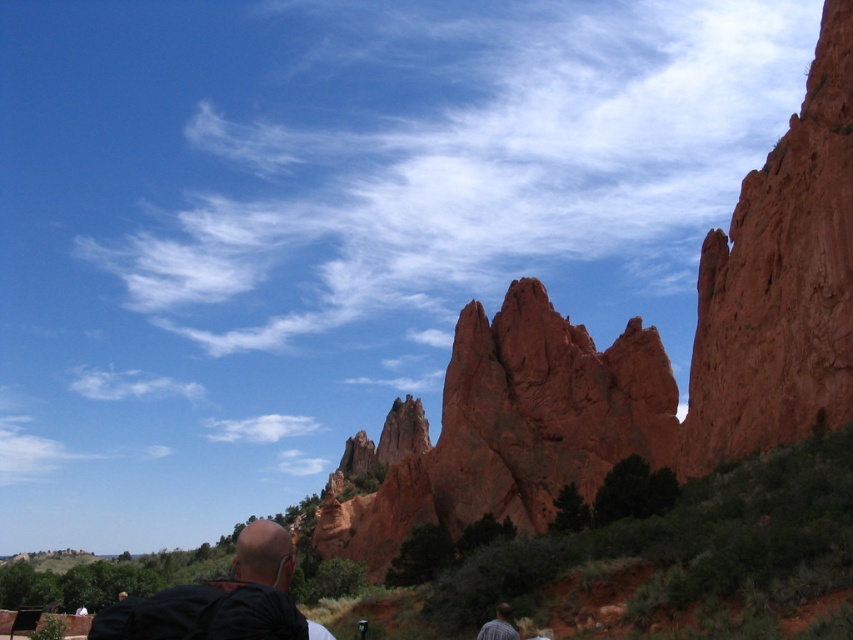
Question: Is the position of rustic sandstone rock formation at center less distant than that of light brown hair at lower center?

Choices:
 (A) no
 (B) yes

Answer: (A)

Question: Which of these objects is positioned closest to the rustic sandstone rock formation at center?

Choices:
 (A) black leather jacket at lower left
 (B) light brown hair at lower center

Answer: (A)

Question: Is rustic sandstone rock formation at center positioned in front of light brown hair at lower center?

Choices:
 (A) no
 (B) yes

Answer: (A)

Question: Which object is closer to the camera taking this photo?

Choices:
 (A) light brown hair at lower center
 (B) black leather jacket at lower left

Answer: (B)

Question: Estimate the real-world distances between objects in this image. Which object is closer to the rustic sandstone rock formation at center?

Choices:
 (A) light brown hair at lower center
 (B) black leather jacket at lower left

Answer: (B)

Question: Can you confirm if rustic sandstone rock formation at center is positioned to the left of black leather jacket at lower left?

Choices:
 (A) yes
 (B) no

Answer: (B)